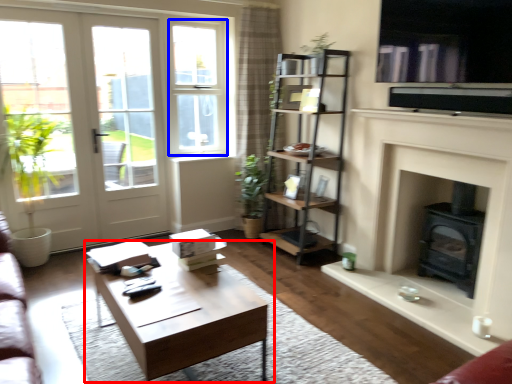
Question: Which of the following is the farthest to the observer, coffee table (highlighted by a red box) or window frame (highlighted by a blue box)?

Choices:
 (A) coffee table
 (B) window frame

Answer: (B)